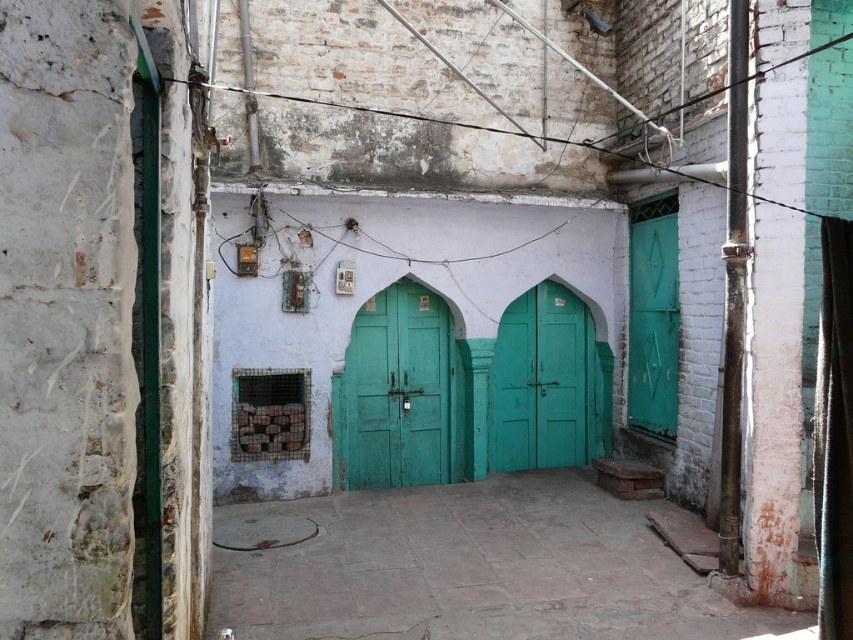
Does point (407, 474) come farther from viewer compared to point (521, 433)?

No, (407, 474) is in front of (521, 433).

Is point (364, 308) farther from viewer compared to point (518, 422)?

No, (364, 308) is closer to viewer.

Locate an element on the screen. teal matte door at center is located at coordinates (397, 390).

Does green matte door at center have a lesser height compared to green matte door at right?

Correct, green matte door at center is not as tall as green matte door at right.

Based on the photo, does green matte door at center appear on the left side of green matte door at right?

Correct, you'll find green matte door at center to the left of green matte door at right.

Describe the element at coordinates (541, 381) in the screenshot. I see `green matte door at center` at that location.

At what (x,y) coordinates should I click in order to perform the action: click on green matte door at center. Please return your answer as a coordinate pair (x, y). Image resolution: width=853 pixels, height=640 pixels. Looking at the image, I should click on (541, 381).

Who is more distant from viewer, (380,445) or (675,300)?

Positioned behind is point (380,445).

Locate an element on the screen. The width and height of the screenshot is (853, 640). teal matte door at center is located at coordinates (397, 390).